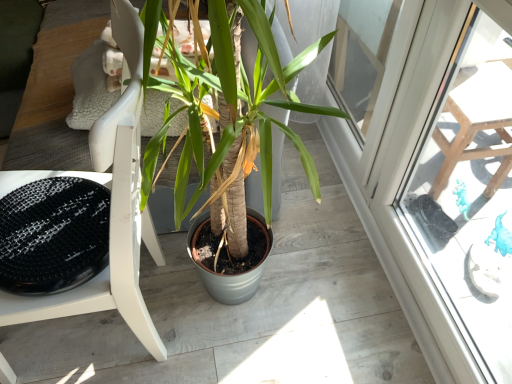
I want to click on green matte plant at center, so click(x=253, y=150).

This screenshot has height=384, width=512. Describe the element at coordinates (253, 150) in the screenshot. I see `green matte plant at center` at that location.

Measure the distance between green matte plant at center and camera.

green matte plant at center and camera are 25.94 inches apart from each other.

This screenshot has height=384, width=512. What do you see at coordinates (111, 210) in the screenshot? I see `white matte chair at center` at bounding box center [111, 210].

Identify the location of white matte chair at center. The width and height of the screenshot is (512, 384). (111, 210).

Identify the location of green matte plant at center. The height and width of the screenshot is (384, 512). (253, 150).

Considering the positions of objects green matte plant at center and white matte chair at center in the image provided, who is more to the left, green matte plant at center or white matte chair at center?

Positioned to the left is green matte plant at center.

Is green matte plant at center in front of or behind white matte chair at center in the image?

In the image, green matte plant at center appears behind white matte chair at center.

Does point (248, 127) come farther from viewer compared to point (25, 181)?

No, (248, 127) is in front of (25, 181).

From the image's perspective, is green matte plant at center above or below white matte chair at center?

Clearly, from the image's perspective, green matte plant at center is above white matte chair at center.

From a real-world perspective, which object rests below the other?

green matte plant at center is physically lower.

Based on the photo, is green matte plant at center thinner than white matte chair at center?

In fact, green matte plant at center might be wider than white matte chair at center.

Is green matte plant at center shorter than white matte chair at center?

Yes.

Does green matte plant at center have a smaller size compared to white matte chair at center?

Actually, green matte plant at center might be larger than white matte chair at center.

Is green matte plant at center inside or outside of white matte chair at center?

green matte plant at center cannot be found inside white matte chair at center.

From the picture: Is green matte plant at center next to white matte chair at center and touching it?

There is a gap between green matte plant at center and white matte chair at center.

Does green matte plant at center turn towards white matte chair at center?

Yes, green matte plant at center is aimed at white matte chair at center.

You are a GUI agent. You are given a task and a screenshot of the screen. Output one action in this format:
    pyautogui.click(x=<x>, y=<y>)
    Task: Click on the chair that is in front of the green matte plant at center
    The height and width of the screenshot is (384, 512).
    Given the screenshot: What is the action you would take?
    pyautogui.click(x=111, y=210)

Considering the positions of objects white matte chair at center and green matte plant at center in the image provided, who is more to the right, white matte chair at center or green matte plant at center?

Positioned to the right is white matte chair at center.

Is white matte chair at center closer to camera compared to green matte plant at center?

Yes, the depth of white matte chair at center is less than that of green matte plant at center.

Does point (127, 176) lie in front of point (268, 183)?

That is True.

From the image's perspective, is white matte chair at center below green matte plant at center?

Indeed, from the image's perspective, white matte chair at center is shown beneath green matte plant at center.

From a real-world perspective, who is located higher, white matte chair at center or green matte plant at center?

white matte chair at center, from a real-world perspective.

Which object is wider, white matte chair at center or green matte plant at center?

green matte plant at center.

Considering the relative sizes of white matte chair at center and green matte plant at center in the image provided, is white matte chair at center shorter than green matte plant at center?

In fact, white matte chair at center may be taller than green matte plant at center.

Does white matte chair at center have a larger size compared to green matte plant at center?

No, white matte chair at center is not bigger than green matte plant at center.

Is green matte plant at center located within white matte chair at center?

Actually, green matte plant at center is outside white matte chair at center.

From the picture: Can you see white matte chair at center touching green matte plant at center?

They are not placed beside each other.

Is white matte chair at center oriented towards green matte plant at center?

No, white matte chair at center does not turn towards green matte plant at center.

How many degrees apart are the facing directions of white matte chair at center and green matte plant at center?

The angle between the facing direction of white matte chair at center and the facing direction of green matte plant at center is 94.1 degrees.

How much distance is there between white matte chair at center and green matte plant at center?

white matte chair at center and green matte plant at center are 9.05 inches apart from each other.

Image resolution: width=512 pixels, height=384 pixels. Find the location of `houseplant on the left of the white matte chair at center`. houseplant on the left of the white matte chair at center is located at coordinates (253, 150).

Where is `houseplant that is under the white matte chair at center (from a real-world perspective)`? This screenshot has width=512, height=384. houseplant that is under the white matte chair at center (from a real-world perspective) is located at coordinates (253, 150).

This screenshot has width=512, height=384. In order to click on houseplant above the white matte chair at center (from the image's perspective) in this screenshot , I will do `click(253, 150)`.